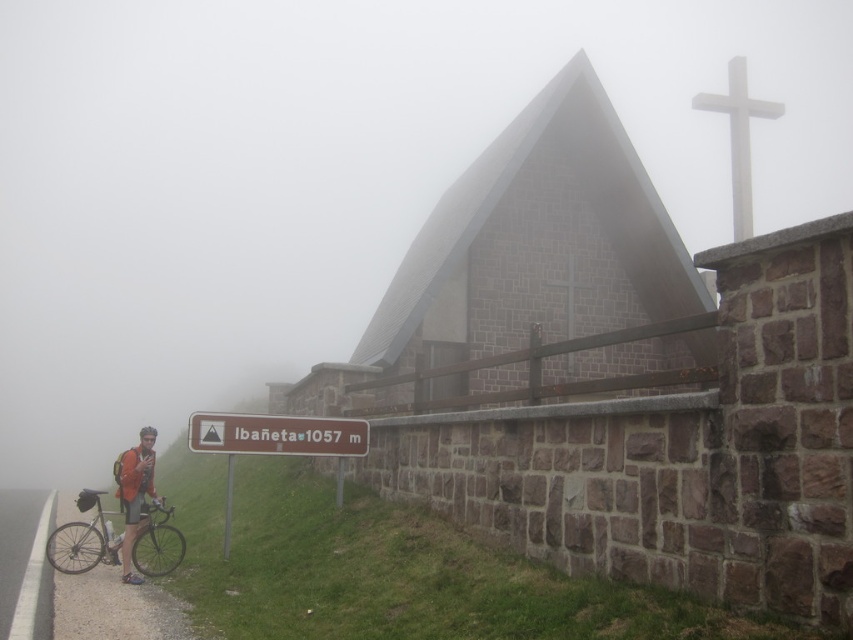
Can you confirm if gray stone church at center is thinner than brown stone sign at lower center?

In fact, gray stone church at center might be wider than brown stone sign at lower center.

Does gray stone church at center appear over brown stone sign at lower center?

Indeed, gray stone church at center is positioned over brown stone sign at lower center.

Who is more forward, (480, 467) or (207, 428)?

Point (480, 467)

In order to click on gray stone church at center in this screenshot , I will do `click(631, 397)`.

The height and width of the screenshot is (640, 853). Identify the location of brown stone sign at lower center. (276, 435).

Is brown stone sign at lower center smaller than matte orange jacket at lower left?

Correct, brown stone sign at lower center occupies less space than matte orange jacket at lower left.

You are a GUI agent. You are given a task and a screenshot of the screen. Output one action in this format:
    pyautogui.click(x=<x>, y=<y>)
    Task: Click on the brown stone sign at lower center
    The width and height of the screenshot is (853, 640).
    Given the screenshot: What is the action you would take?
    pyautogui.click(x=276, y=435)

Identify the location of brown stone sign at lower center. The height and width of the screenshot is (640, 853). (276, 435).

Which is above, gray stone church at center or silver metallic bicycle at lower left?

Positioned higher is gray stone church at center.

Is gray stone church at center wider than silver metallic bicycle at lower left?

Yes, gray stone church at center is wider than silver metallic bicycle at lower left.

Which is behind, point (769, 419) or point (74, 568)?

The point (74, 568) is more distant.

Identify the location of gray stone church at center. The height and width of the screenshot is (640, 853). (631, 397).